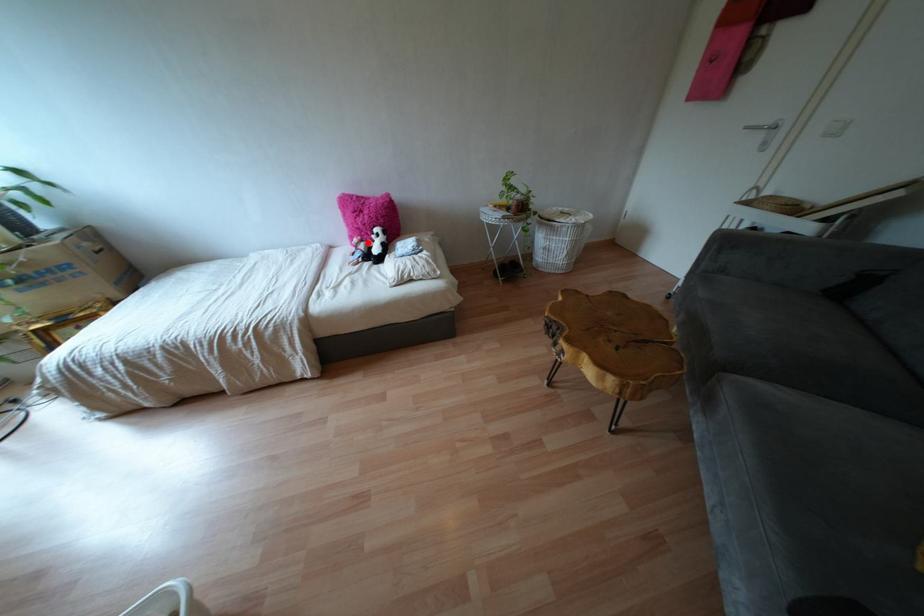
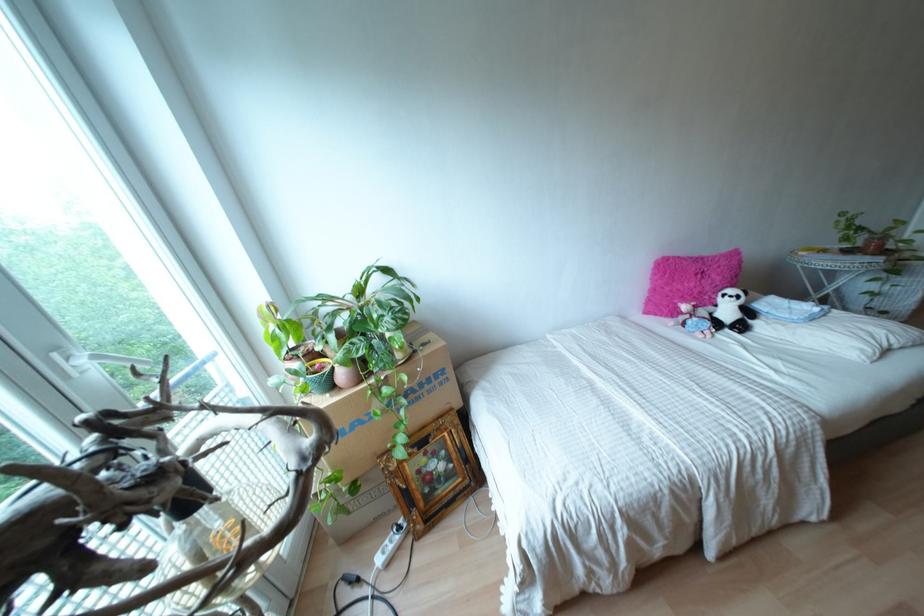
The point at the highlighted location is marked in the first image. Where is the corresponding point in the second image?

(710, 308)